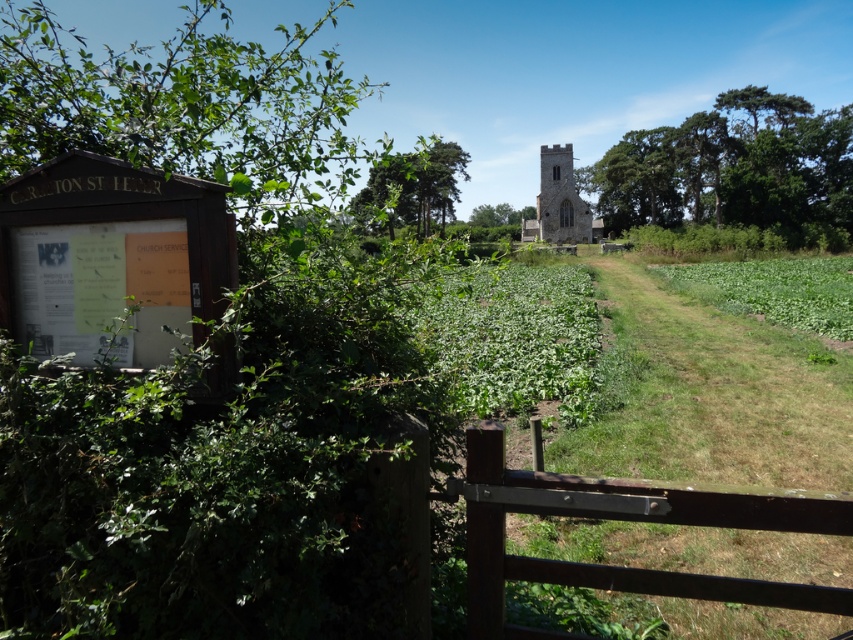
You are a tourist holding a map and standing at the entrance of the Carlton St Peter Church grounds. You see the brown wooden gate at lower center and the green leafy tree at center. According to the map, you need to walk straight to reach the church. Which object will you pass first?

The brown wooden gate at lower center is in front of the green leafy tree at center, so you will pass the brown wooden gate at lower center first before reaching the green leafy tree at center.